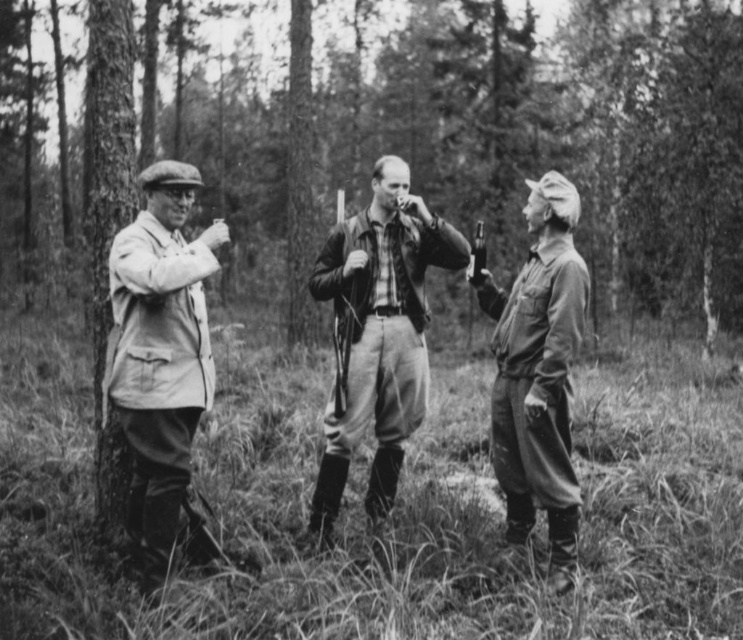
Question: Among these objects, which one is farthest from the camera?

Choices:
 (A) smooth bark tree at center
 (B) leather jacket at center
 (C) matte khaki shirt at center
 (D) light beige fabric coat at left

Answer: (A)

Question: Which object is farther from the camera taking this photo?

Choices:
 (A) matte khaki shirt at center
 (B) light beige fabric coat at left

Answer: (A)

Question: Can you confirm if leather jacket at center is positioned to the right of matte khaki shirt at center?

Choices:
 (A) no
 (B) yes

Answer: (A)

Question: Estimate the real-world distances between objects in this image. Which object is closer to the matte khaki shirt at center?

Choices:
 (A) smooth bark tree at center
 (B) light beige fabric coat at left

Answer: (B)

Question: Does smooth bark tree at center have a larger size compared to light beige fabric coat at left?

Choices:
 (A) no
 (B) yes

Answer: (B)

Question: Can you confirm if smooth bark tree at center is thinner than matte khaki shirt at center?

Choices:
 (A) no
 (B) yes

Answer: (A)